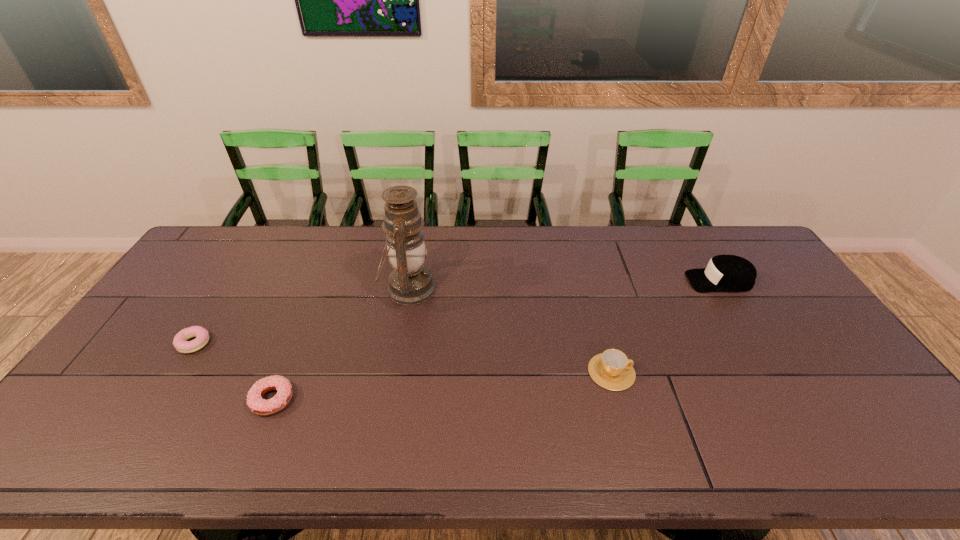
Locate an element on the screen. This screenshot has height=540, width=960. oil lamp is located at coordinates (410, 282).

Locate an element on the screen. The height and width of the screenshot is (540, 960). the third object from right to left is located at coordinates (410, 282).

You are a GUI agent. You are given a task and a screenshot of the screen. Output one action in this format:
    pyautogui.click(x=<x>, y=<y>)
    Task: Click on the second tallest object
    
    Given the screenshot: What is the action you would take?
    pyautogui.click(x=729, y=273)

The height and width of the screenshot is (540, 960). Find the location of `cap`. cap is located at coordinates (729, 273).

Locate an element on the screen. the third tallest object is located at coordinates (612, 370).

You are a GUI agent. You are given a task and a screenshot of the screen. Output one action in this format:
    pyautogui.click(x=<x>, y=<y>)
    Task: Click on the fourth object from left to right
    
    Given the screenshot: What is the action you would take?
    pyautogui.click(x=612, y=370)

Where is `the nearer doughnut`? The height and width of the screenshot is (540, 960). the nearer doughnut is located at coordinates click(x=259, y=406).

Image resolution: width=960 pixels, height=540 pixels. I want to click on the right doughnut, so click(x=259, y=406).

Where is `the leftmost object`? The width and height of the screenshot is (960, 540). the leftmost object is located at coordinates (180, 342).

Locate an element on the screen. The height and width of the screenshot is (540, 960). the left doughnut is located at coordinates (180, 342).